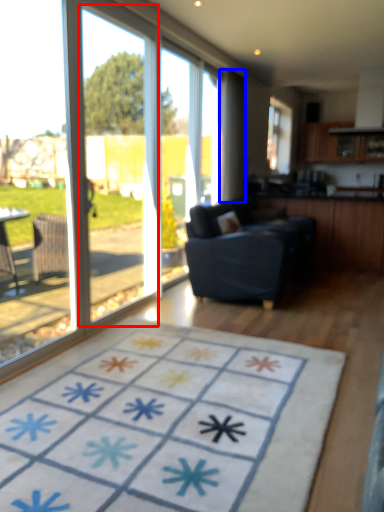
Question: Which of the following is the closest to the observer, screen door (highlighted by a red box) or curtain (highlighted by a blue box)?

Choices:
 (A) screen door
 (B) curtain

Answer: (A)